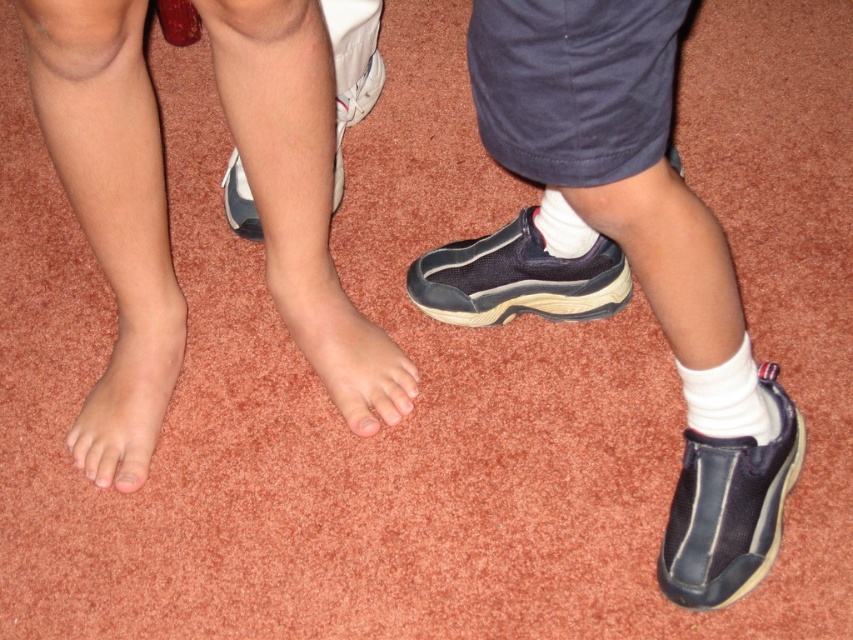
You are trying to find the matte blue shoe at right in a cluttered room. According to the scene, where would you look relative to the navy blue fabric shoe at lower right?

The matte blue shoe at right is positioned over the navy blue fabric shoe at lower right, so you should look directly above the navy blue fabric shoe at lower right to find it.

You are designing a shoe organizer and need to know the relative sizes of the items. Given the scene, which object is wider between the white leather shoe at center and the pink matte toe at center?

The white leather shoe at center is wider than the pink matte toe at center, as its width surpasses the latter according to the description.

You are a photographer setting up a shoot in the scene described. You need to place a small prop between the matte blue shoe at right and the white soft sock at center. Based on their positions, where should you place the prop to ensure it is between them?

The prop should be placed between the matte blue shoe at right and the white soft sock at center, closer to the white soft sock at center since the matte blue shoe at right is positioned under it.